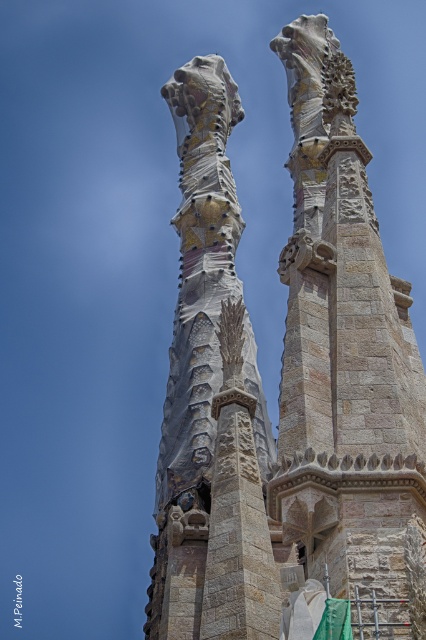
Can you confirm if stone textured spire at center is bigger than stone textured column at center?

Indeed, stone textured spire at center has a larger size compared to stone textured column at center.

Who is positioned more to the right, stone textured spire at center or stone textured column at center?

stone textured spire at center

Between point (294, 92) and point (176, 140), which one is positioned behind?

Point (176, 140)

What are the coordinates of `stone textured spire at center` in the screenshot? It's located at (345, 362).